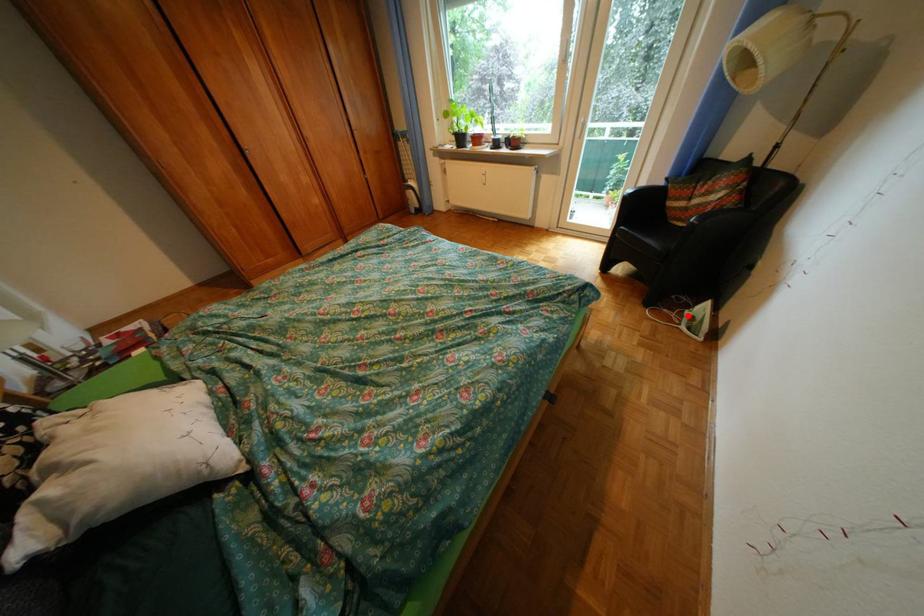
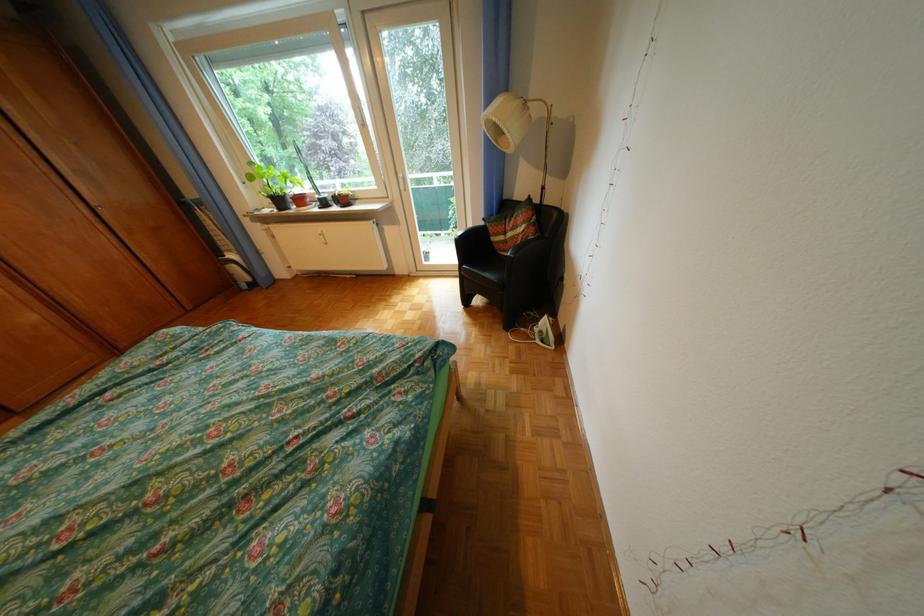
Find the pixel in the second image that matches the highlighted location in the first image.

(542, 331)